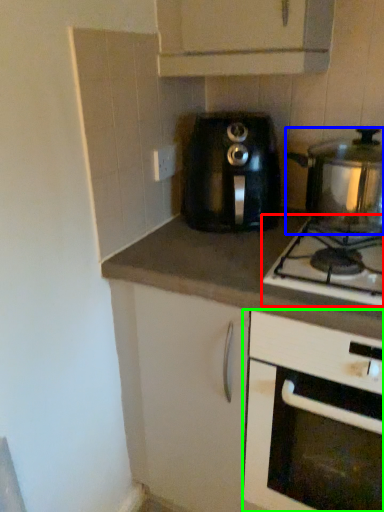
Question: Estimate the real-world distances between objects in this image. Which object is farther from gas stove (highlighted by a red box), kitchen appliance (highlighted by a blue box) or cabinetry (highlighted by a green box)?

Choices:
 (A) kitchen appliance
 (B) cabinetry

Answer: (B)